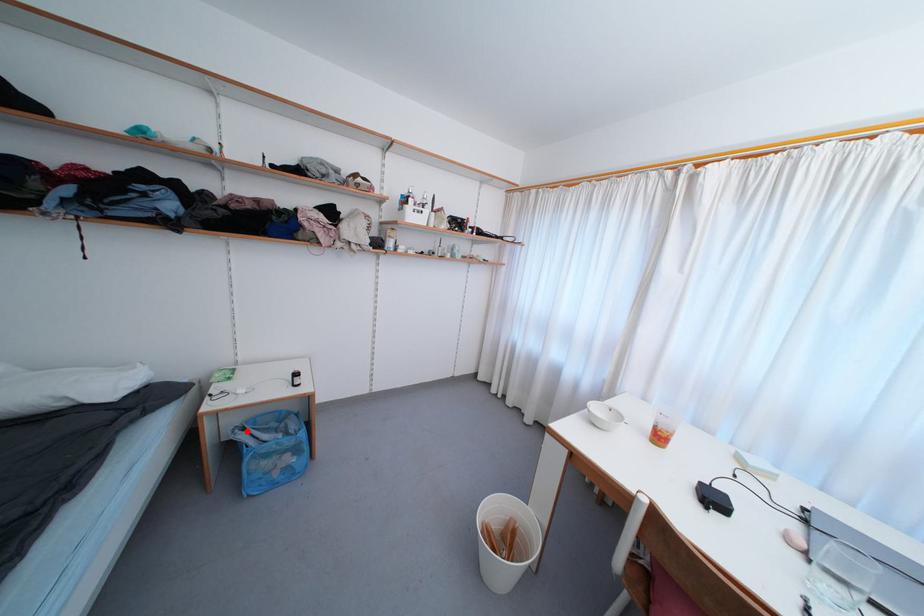
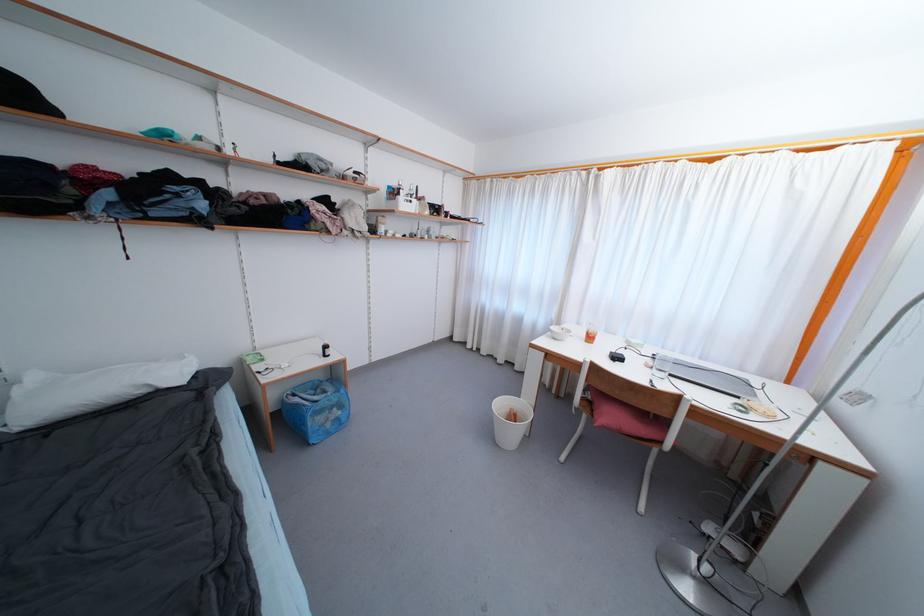
Question: I am providing you with two images of the same scene from different viewpoints. A red point is shown in image1. For the corresponding object point in image2, is it positioned nearer or farther from the camera?

Choices:
 (A) Nearer
 (B) Farther

Answer: (B)